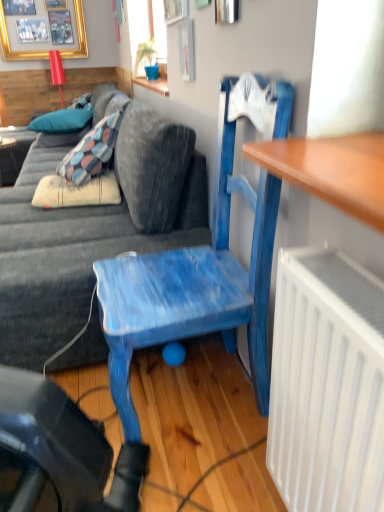
Question: Is blue fabric pillow at upper left, the first pillow from the top, wider or thinner than matte black desk at left?

Choices:
 (A) thin
 (B) wide

Answer: (B)

Question: From the image's perspective, is blue fabric pillow at upper left, which is counted as the second pillow, starting from the bottom, above or below matte black desk at left?

Choices:
 (A) below
 (B) above

Answer: (B)

Question: Which object is the closest to the blue fabric pillow at upper left, which is counted as the second pillow, starting from the bottom?

Choices:
 (A) velvet blue couch at center
 (B) blue painted wood chair at center
 (C) gold framed picture at upper left
 (D) matte black desk at left
 (E) blue fabric pillow at upper left, the first pillow from the bottom

Answer: (E)

Question: Which is farther from the matte black desk at left?

Choices:
 (A) blue fabric pillow at upper left, which is counted as the second pillow, starting from the bottom
 (B) gold framed picture at upper left
 (C) velvet blue couch at center
 (D) blue fabric pillow at upper left, the first pillow from the bottom
 (E) blue painted wood chair at center

Answer: (E)